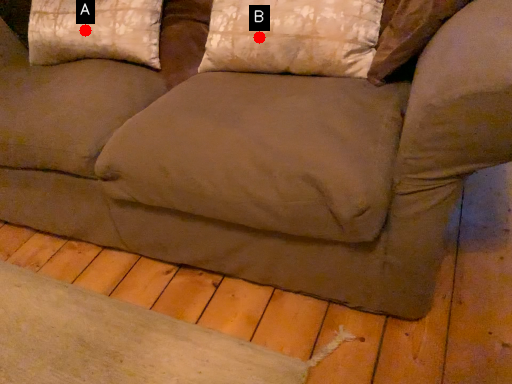
Question: Two points are circled on the image, labeled by A and B beside each circle. Which point is further to the camera?

Choices:
 (A) A is further
 (B) B is further

Answer: (A)